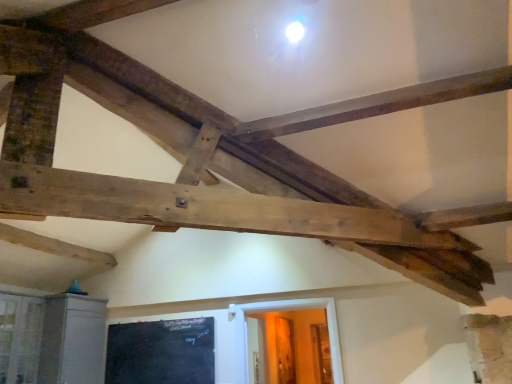
At what (x,y) coordinates should I click in order to perform the action: click on white wooden door at lower center. Please return your answer as a coordinate pair (x, y). Looking at the image, I should click on (257, 349).

Is white wooden door at lower center further to the viewer compared to clear glass window at lower left?

Yes, it is.

Between white wooden door at lower center and clear glass window at lower left, which one has larger width?

Wider between the two is clear glass window at lower left.

Who is smaller, white wooden door at lower center or clear glass window at lower left?

white wooden door at lower center.

Identify the location of door on the right of clear glass window at lower left. (257, 349).

Looking at the image, does black chalkboard at lower left seem bigger or smaller compared to clear glass window at lower left?

Clearly, black chalkboard at lower left is smaller in size than clear glass window at lower left.

The width and height of the screenshot is (512, 384). In order to click on window above the black chalkboard at lower left (from a real-world perspective) in this screenshot , I will do `click(20, 337)`.

Which of these two, black chalkboard at lower left or clear glass window at lower left, stands shorter?

black chalkboard at lower left.

Considering the positions of objects black chalkboard at lower left and white wooden door at lower center in the image provided, who is behind, black chalkboard at lower left or white wooden door at lower center?

white wooden door at lower center.

From the image's perspective, between black chalkboard at lower left and white wooden door at lower center, who is located below?

white wooden door at lower center, from the image's perspective.

Does black chalkboard at lower left have a lesser width compared to white wooden door at lower center?

Indeed, black chalkboard at lower left has a lesser width compared to white wooden door at lower center.

Is white wooden door at lower center inside or outside of black chalkboard at lower left?

white wooden door at lower center is not inside black chalkboard at lower left, it's outside.

Consider the image. Considering the sizes of white wooden door at lower center and black chalkboard at lower left in the image, is white wooden door at lower center wider or thinner than black chalkboard at lower left?

Considering their sizes, white wooden door at lower center looks broader than black chalkboard at lower left.

Based on the photo, from the image's perspective, is white wooden door at lower center over black chalkboard at lower left?

No, from the image's perspective, white wooden door at lower center is not over black chalkboard at lower left.

Between point (263, 336) and point (181, 368), which one is positioned behind?

The point (263, 336) is farther.

Based on the photo, is clear glass window at lower left facing away from black chalkboard at lower left?

That's not correct — clear glass window at lower left is not looking away from black chalkboard at lower left.

Between clear glass window at lower left and black chalkboard at lower left, which one is positioned in front?

Positioned in front is clear glass window at lower left.

Is black chalkboard at lower left located within clear glass window at lower left?

No, clear glass window at lower left does not contain black chalkboard at lower left.

Locate an element on the screen. This screenshot has width=512, height=384. window above the white wooden door at lower center (from a real-world perspective) is located at coordinates (20, 337).

Is clear glass window at lower left turned away from white wooden door at lower center?

No.

From the image's perspective, would you say clear glass window at lower left is positioned over white wooden door at lower center?

Yes, from the image's perspective, clear glass window at lower left is over white wooden door at lower center.

Locate an element on the screen. The height and width of the screenshot is (384, 512). window located in front of the white wooden door at lower center is located at coordinates (20, 337).

Identify the location of window above the black chalkboard at lower left (from the image's perspective). (20, 337).

Looking at the image, which one is located further to white wooden door at lower center, clear glass window at lower left or black chalkboard at lower left?

Among the two, clear glass window at lower left is located further to white wooden door at lower center.

When comparing their distances from clear glass window at lower left, does white wooden door at lower center or black chalkboard at lower left seem closer?

black chalkboard at lower left is positioned closer to the anchor clear glass window at lower left.

Which object lies nearer to the anchor point black chalkboard at lower left, white wooden door at lower center or clear glass window at lower left?

Based on the image, clear glass window at lower left appears to be nearer to black chalkboard at lower left.

Consider the image. From the image, which object appears to be farther from clear glass window at lower left, black chalkboard at lower left or white wooden door at lower center?

white wooden door at lower center lies further to clear glass window at lower left than the other object.

When comparing their distances from black chalkboard at lower left, does clear glass window at lower left or white wooden door at lower center seem further?

The object further to black chalkboard at lower left is white wooden door at lower center.

Which object lies nearer to the anchor point white wooden door at lower center, black chalkboard at lower left or clear glass window at lower left?

black chalkboard at lower left lies closer to white wooden door at lower center than the other object.

Find the location of a particular element. bulletin board between clear glass window at lower left and white wooden door at lower center is located at coordinates (161, 352).